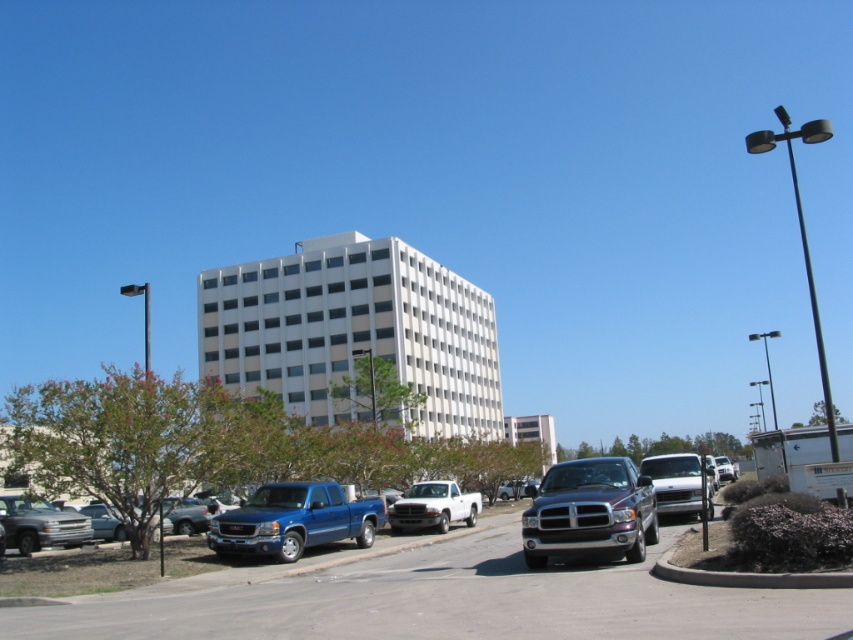
Is white matte trailer at lower right closer to camera compared to silver metallic truck at lower left?

Yes.

Does white matte trailer at lower right have a smaller size compared to silver metallic truck at lower left?

Actually, white matte trailer at lower right might be larger than silver metallic truck at lower left.

Where is `white matte trailer at lower right`? The image size is (853, 640). white matte trailer at lower right is located at coordinates (805, 460).

At what (x,y) coordinates should I click in order to perform the action: click on white matte trailer at lower right. Please return your answer as a coordinate pair (x, y). This screenshot has height=640, width=853. Looking at the image, I should click on (805, 460).

Does blue metallic pickup truck at center appear over white matte truck at center?

Yes, blue metallic pickup truck at center is above white matte truck at center.

Between blue metallic pickup truck at center and white matte truck at center, which one has more height?

white matte truck at center is taller.

The image size is (853, 640). In order to click on blue metallic pickup truck at center in this screenshot , I will do `click(294, 520)`.

Which is behind, point (77, 520) or point (693, 493)?

The point (77, 520) is more distant.

Is silver metallic truck at lower left taller than silver metallic van at center-right?

Incorrect, silver metallic truck at lower left's height is not larger of silver metallic van at center-right's.

Does point (9, 540) come in front of point (653, 458)?

Yes.

Where is `silver metallic truck at lower left`? This screenshot has width=853, height=640. silver metallic truck at lower left is located at coordinates (39, 524).